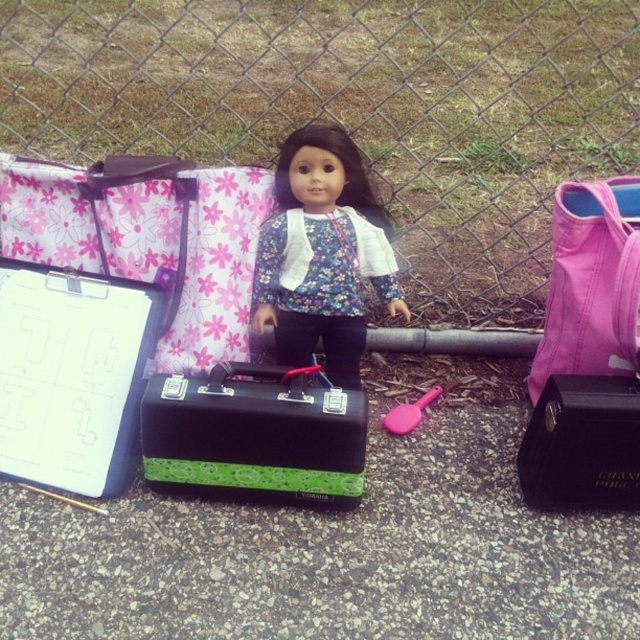
Who is more forward, (406, 54) or (387, 253)?

Point (387, 253) is more forward.

Can you confirm if metallic chain-link fence at upper center is bigger than matte floral doll at center?

Correct, metallic chain-link fence at upper center is larger in size than matte floral doll at center.

Find the location of a particular element. This screenshot has width=640, height=640. metallic chain-link fence at upper center is located at coordinates (353, 109).

Identify the location of metallic chain-link fence at upper center. (353, 109).

Is metallic chain-link fence at upper center further to camera compared to green textured case at center?

That is True.

In the scene shown: Can you confirm if metallic chain-link fence at upper center is positioned to the right of green textured case at center?

Incorrect, metallic chain-link fence at upper center is not on the right side of green textured case at center.

Between point (440, 275) and point (305, 420), which one is positioned in front?

Point (305, 420) is in front.

Where is `metallic chain-link fence at upper center`? metallic chain-link fence at upper center is located at coordinates (353, 109).

Consider the image. Who is more forward, (65,308) or (394,406)?

Point (65,308)

At what (x,y) coordinates should I click in order to perform the action: click on green matte suitcase at center. Please return your answer as a coordinate pair (x, y). This screenshot has height=640, width=640. Looking at the image, I should click on (72, 376).